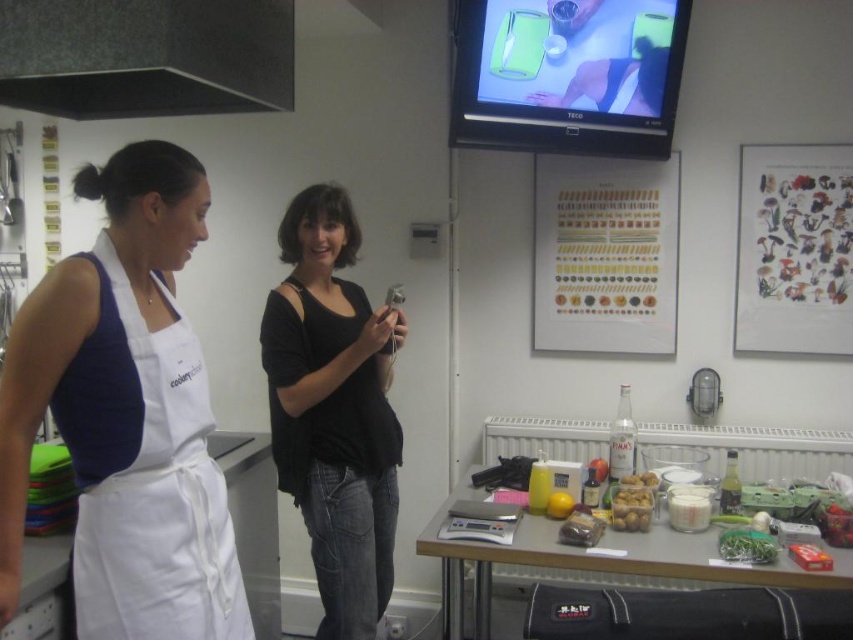
This screenshot has height=640, width=853. What do you see at coordinates (146, 56) in the screenshot?
I see `black matte exhaust hood at upper left` at bounding box center [146, 56].

Is point (109, 81) behind point (583, 336)?

No, (109, 81) is closer to viewer.

Image resolution: width=853 pixels, height=640 pixels. What are the coordinates of `black matte exhaust hood at upper left` in the screenshot? It's located at (146, 56).

Which of these two, white fabric apron at left or wooden poster at upper center, stands shorter?

wooden poster at upper center

Find the location of a particular element. The image size is (853, 640). white fabric apron at left is located at coordinates (146, 476).

Who is more distant from viewer, (x=169, y=502) or (x=538, y=326)?

Point (x=538, y=326)

Identify the location of white fabric apron at left. (146, 476).

Can you confirm if wooden poster at upper center is shorter than translucent plastic container at center?

No.

Which of these two, wooden poster at upper center or translucent plastic container at center, stands taller?

wooden poster at upper center is taller.

Is point (650, 342) in front of point (610, 518)?

That is False.

This screenshot has height=640, width=853. Find the location of `wooden poster at upper center`. wooden poster at upper center is located at coordinates (605, 253).